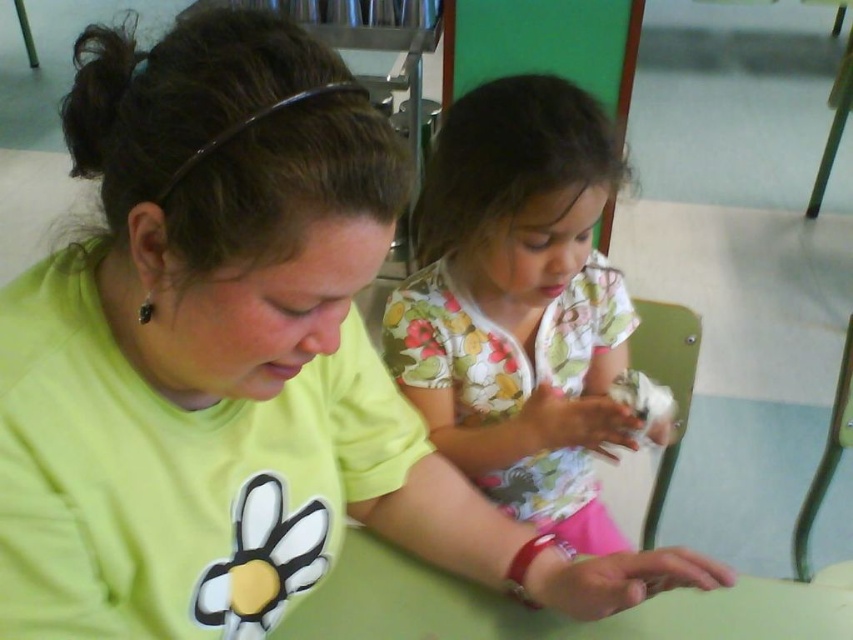
Which of these two, floral cotton shirt at center or green matte table at center, stands shorter?

Standing shorter between the two is green matte table at center.

Describe the element at coordinates (519, 304) in the screenshot. I see `floral cotton shirt at center` at that location.

Between point (508, 333) and point (786, 605), which one is positioned behind?

The point (508, 333) is behind.

This screenshot has width=853, height=640. What are the coordinates of `floral cotton shirt at center` in the screenshot? It's located at (519, 304).